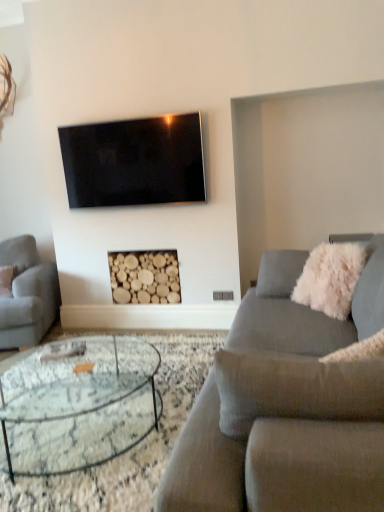
The height and width of the screenshot is (512, 384). Find the location of `vacant region above natural wood logs at center (from a real-world perspective)`. vacant region above natural wood logs at center (from a real-world perspective) is located at coordinates (139, 250).